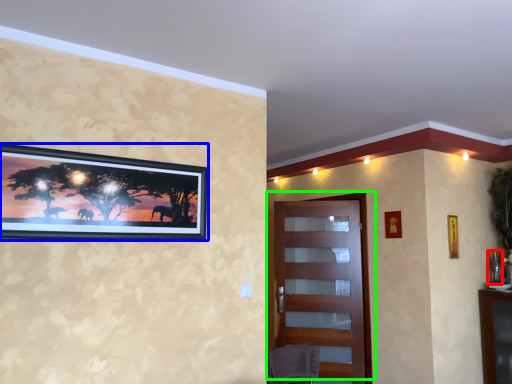
Question: Estimate the real-world distances between objects in this image. Which object is farther from picture frame (highlighted by a red box), picture frame (highlighted by a blue box) or door (highlighted by a green box)?

Choices:
 (A) picture frame
 (B) door

Answer: (A)